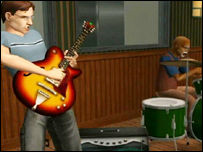
Locate an element on the screen. The height and width of the screenshot is (152, 203). chest is located at coordinates (23, 52).